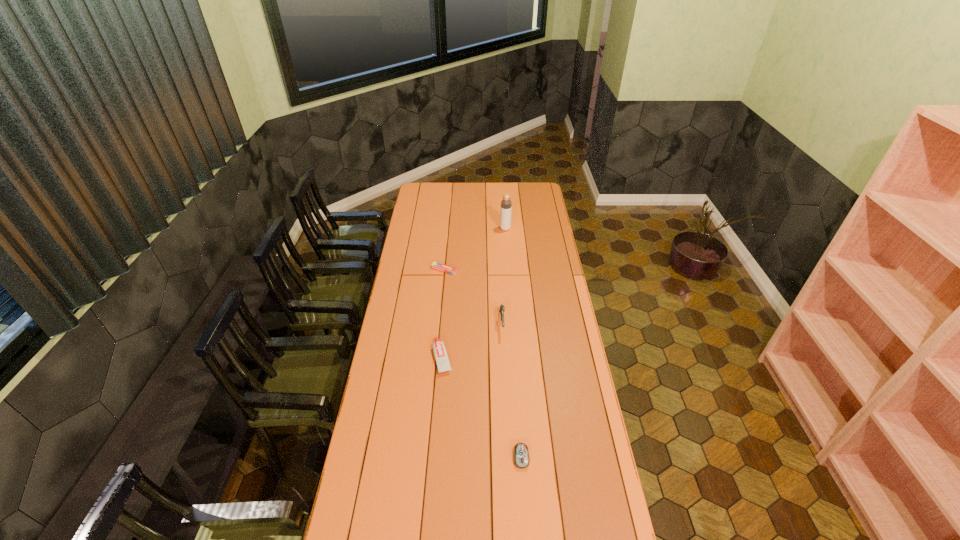
The image size is (960, 540). What are the coordinates of `vacant area situated 0.400m aiming along the barrel of the gun` in the screenshot? It's located at (507, 418).

You are a GUI agent. You are given a task and a screenshot of the screen. Output one action in this format:
    pyautogui.click(x=<x>, y=<y>)
    Task: Click on the vacant region located 0.390m on the back of the nearer toothpaste
    The width and height of the screenshot is (960, 540).
    Given the screenshot: What is the action you would take?
    pyautogui.click(x=448, y=282)

Image resolution: width=960 pixels, height=540 pixels. In order to click on vacant region located on the wheel side of the nearest object in this screenshot , I will do `click(525, 506)`.

Image resolution: width=960 pixels, height=540 pixels. I want to click on vacant area situated on the right of the shorter toothpaste, so click(x=506, y=270).

In the image, there is a desktop. In order to click on blank space at the left edge in this screenshot , I will do `click(396, 289)`.

This screenshot has height=540, width=960. In the image, there is a desktop. Identify the location of vacant area at the right edge. coord(608,496).

In the image, there is a desktop. Where is `free region at the far left corner`? This screenshot has width=960, height=540. free region at the far left corner is located at coordinates (434, 188).

Where is `unoccupied area between the second nearest object and the gun`? This screenshot has width=960, height=540. unoccupied area between the second nearest object and the gun is located at coordinates (472, 340).

Locate an element on the screen. vacant space that is in between the farthest object and the shortest object is located at coordinates (474, 249).

Identify the location of free space between the farther toothpaste and the taller toothpaste. The width and height of the screenshot is (960, 540). (444, 314).